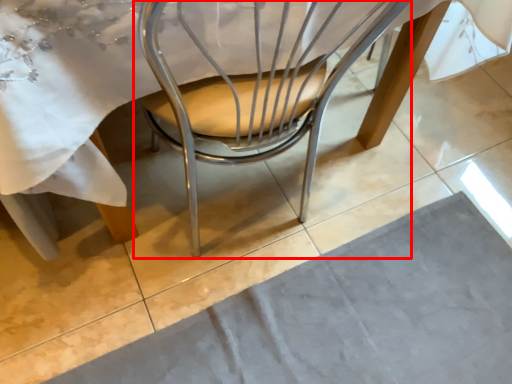
Question: From the image's perspective, where is chair (annotated by the red box) located in relation to place mat in the image?

Choices:
 (A) below
 (B) above

Answer: (B)